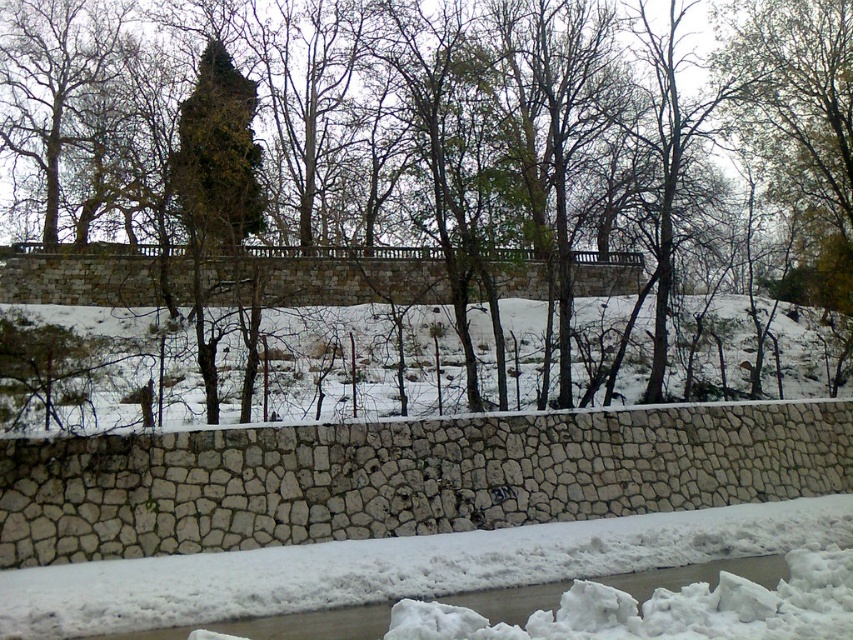
You are an observer standing in front of the winter scene. You notice the green leafy tree at upper center and the white fluffy snow at lower center. Which object occupies a wider area in the image?

The green leafy tree at upper center occupies a wider area than the white fluffy snow at lower center because its width is larger according to the description.

You are an observer standing in front of the stone wall. You notice the white fluffy snow at lower center and the green mossy tree at upper center. Which of these two objects is larger in size?

The green mossy tree at upper center is larger than the white fluffy snow at lower center.

You are a bird looking for a place to perch. You see a green leafy tree at upper center and a green mossy tree at upper center. Which tree is farther away from the other?

The green leafy tree at upper center is 7.69 meters away from the green mossy tree at upper center, so they are both at the same distance from each other as the measurement indicates.